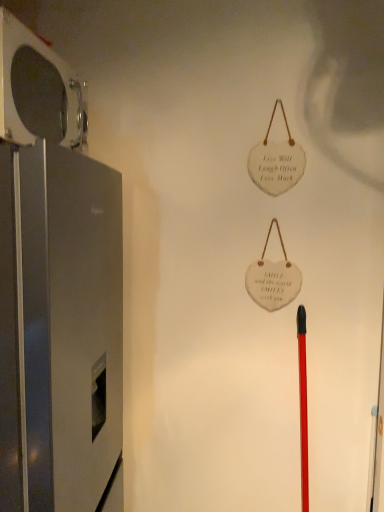
What do you see at coordinates (38, 90) in the screenshot?
I see `metallic gray refrigerator at left, which appears as the 2th appliance when ordered from the bottom` at bounding box center [38, 90].

Identify the location of metallic gray refrigerator at left, which appears as the first appliance when viewed from the top. (38, 90).

What is the approximate width of metallic gray refrigerator at left, which appears as the first appliance when viewed from the top?

11.43 inches.

Measure the distance between metallic gray refrigerator at left, which appears as the first appliance when viewed from the top, and camera.

metallic gray refrigerator at left, which appears as the first appliance when viewed from the top, is 30.98 inches from camera.

I want to click on satin silver refrigerator at left, the 1th appliance when ordered from bottom to top, so click(x=61, y=327).

The width and height of the screenshot is (384, 512). Describe the element at coordinates (61, 327) in the screenshot. I see `satin silver refrigerator at left, the 1th appliance when ordered from bottom to top` at that location.

In order to face satin silver refrigerator at left, the second appliance positioned from the top, should I rotate leftwards or rightwards?

Rotate left and turn 21.458 degrees.

At what (x,y) coordinates should I click in order to perform the action: click on metallic gray refrigerator at left, which appears as the 2th appliance when ordered from the bottom. Please return your answer as a coordinate pair (x, y). Looking at the image, I should click on (38, 90).

Considering the positions of objects metallic gray refrigerator at left, which appears as the 2th appliance when ordered from the bottom, and satin silver refrigerator at left, the 1th appliance when ordered from bottom to top, in the image provided, who is more to the right, metallic gray refrigerator at left, which appears as the 2th appliance when ordered from the bottom, or satin silver refrigerator at left, the 1th appliance when ordered from bottom to top,?

Positioned to the right is satin silver refrigerator at left, the 1th appliance when ordered from bottom to top.

Is metallic gray refrigerator at left, which appears as the first appliance when viewed from the top, further to camera compared to satin silver refrigerator at left, the 1th appliance when ordered from bottom to top?

Yes, the depth of metallic gray refrigerator at left, which appears as the first appliance when viewed from the top, is greater than that of satin silver refrigerator at left, the 1th appliance when ordered from bottom to top.

Which point is more forward, (61, 141) or (115, 444)?

Point (61, 141)

From the image's perspective, relative to satin silver refrigerator at left, the 1th appliance when ordered from bottom to top, is metallic gray refrigerator at left, which appears as the 2th appliance when ordered from the bottom, above or below?

A: metallic gray refrigerator at left, which appears as the 2th appliance when ordered from the bottom, is situated higher than satin silver refrigerator at left, the 1th appliance when ordered from bottom to top, in the image.

From a real-world perspective, relative to satin silver refrigerator at left, the second appliance positioned from the top, is metallic gray refrigerator at left, which appears as the 2th appliance when ordered from the bottom, vertically above or below?

In terms of real-world spatial position, metallic gray refrigerator at left, which appears as the 2th appliance when ordered from the bottom, is above satin silver refrigerator at left, the second appliance positioned from the top.

Between metallic gray refrigerator at left, which appears as the 2th appliance when ordered from the bottom, and satin silver refrigerator at left, the 1th appliance when ordered from bottom to top, which one has larger width?

Wider between the two is satin silver refrigerator at left, the 1th appliance when ordered from bottom to top.

From their relative heights in the image, would you say metallic gray refrigerator at left, which appears as the 2th appliance when ordered from the bottom, is taller or shorter than satin silver refrigerator at left, the second appliance positioned from the top?

Clearly, metallic gray refrigerator at left, which appears as the 2th appliance when ordered from the bottom, is shorter compared to satin silver refrigerator at left, the second appliance positioned from the top.

Can you confirm if metallic gray refrigerator at left, which appears as the 2th appliance when ordered from the bottom, is bigger than satin silver refrigerator at left, the 1th appliance when ordered from bottom to top?

No.

Consider the image. Is satin silver refrigerator at left, the second appliance positioned from the top, a part of metallic gray refrigerator at left, which appears as the 2th appliance when ordered from the bottom?

Definitely not — satin silver refrigerator at left, the second appliance positioned from the top, is not inside metallic gray refrigerator at left, which appears as the 2th appliance when ordered from the bottom.

Is metallic gray refrigerator at left, which appears as the 2th appliance when ordered from the bottom, positioned with its back to satin silver refrigerator at left, the second appliance positioned from the top?

No, metallic gray refrigerator at left, which appears as the 2th appliance when ordered from the bottom, is not facing away from satin silver refrigerator at left, the second appliance positioned from the top.

Can you tell me how much metallic gray refrigerator at left, which appears as the first appliance when viewed from the top, and satin silver refrigerator at left, the second appliance positioned from the top, differ in facing direction?

The facing directions of metallic gray refrigerator at left, which appears as the first appliance when viewed from the top, and satin silver refrigerator at left, the second appliance positioned from the top, are 2.64 degrees apart.

Identify the location of appliance on the left of satin silver refrigerator at left, the 1th appliance when ordered from bottom to top. The width and height of the screenshot is (384, 512). (38, 90).

Considering the positions of objects satin silver refrigerator at left, the 1th appliance when ordered from bottom to top, and metallic gray refrigerator at left, which appears as the 2th appliance when ordered from the bottom, in the image provided, who is more to the right, satin silver refrigerator at left, the 1th appliance when ordered from bottom to top, or metallic gray refrigerator at left, which appears as the 2th appliance when ordered from the bottom,?

satin silver refrigerator at left, the 1th appliance when ordered from bottom to top.

In the scene shown: Considering their positions, is satin silver refrigerator at left, the 1th appliance when ordered from bottom to top, located in front of or behind metallic gray refrigerator at left, which appears as the 2th appliance when ordered from the bottom?

Clearly, satin silver refrigerator at left, the 1th appliance when ordered from bottom to top, is in front of metallic gray refrigerator at left, which appears as the 2th appliance when ordered from the bottom.

Considering the points (44, 437) and (68, 135), which point is in front, point (44, 437) or point (68, 135)?

Positioned in front is point (44, 437).

From the image's perspective, which is below, satin silver refrigerator at left, the second appliance positioned from the top, or metallic gray refrigerator at left, which appears as the 2th appliance when ordered from the bottom?

satin silver refrigerator at left, the second appliance positioned from the top, from the image's perspective.

From a real-world perspective, who is located higher, satin silver refrigerator at left, the second appliance positioned from the top, or metallic gray refrigerator at left, which appears as the first appliance when viewed from the top?

metallic gray refrigerator at left, which appears as the first appliance when viewed from the top, is physically above.

Can you confirm if satin silver refrigerator at left, the second appliance positioned from the top, is wider than metallic gray refrigerator at left, which appears as the first appliance when viewed from the top?

Yes, satin silver refrigerator at left, the second appliance positioned from the top, is wider than metallic gray refrigerator at left, which appears as the first appliance when viewed from the top.

Does satin silver refrigerator at left, the 1th appliance when ordered from bottom to top, have a lesser height compared to metallic gray refrigerator at left, which appears as the first appliance when viewed from the top?

No.

Is satin silver refrigerator at left, the 1th appliance when ordered from bottom to top, smaller than metallic gray refrigerator at left, which appears as the first appliance when viewed from the top?

No, satin silver refrigerator at left, the 1th appliance when ordered from bottom to top, is not smaller than metallic gray refrigerator at left, which appears as the first appliance when viewed from the top.

In the scene shown: Is metallic gray refrigerator at left, which appears as the first appliance when viewed from the top, a part of satin silver refrigerator at left, the second appliance positioned from the top?

Actually, metallic gray refrigerator at left, which appears as the first appliance when viewed from the top, is outside satin silver refrigerator at left, the second appliance positioned from the top.

Are satin silver refrigerator at left, the second appliance positioned from the top, and metallic gray refrigerator at left, which appears as the 2th appliance when ordered from the bottom, located far from each other?

satin silver refrigerator at left, the second appliance positioned from the top, is actually quite close to metallic gray refrigerator at left, which appears as the 2th appliance when ordered from the bottom.

Is satin silver refrigerator at left, the second appliance positioned from the top, facing away from metallic gray refrigerator at left, which appears as the 2th appliance when ordered from the bottom?

satin silver refrigerator at left, the second appliance positioned from the top, does not have its back to metallic gray refrigerator at left, which appears as the 2th appliance when ordered from the bottom.

In the scene shown: Can you tell me how much satin silver refrigerator at left, the second appliance positioned from the top, and metallic gray refrigerator at left, which appears as the first appliance when viewed from the top, differ in facing direction?

There is a 2.64-degree angle between the facing directions of satin silver refrigerator at left, the second appliance positioned from the top, and metallic gray refrigerator at left, which appears as the first appliance when viewed from the top.

Measure the distance from satin silver refrigerator at left, the 1th appliance when ordered from bottom to top, to metallic gray refrigerator at left, which appears as the 2th appliance when ordered from the bottom.

They are 12.66 inches apart.

What are the coordinates of `appliance located on the right of metallic gray refrigerator at left, which appears as the 2th appliance when ordered from the bottom` in the screenshot? It's located at (61, 327).

Identify the location of appliance lying behind the satin silver refrigerator at left, the second appliance positioned from the top. The image size is (384, 512). [38, 90].

Where is `appliance on the left side of satin silver refrigerator at left, the 1th appliance when ordered from bottom to top`? The image size is (384, 512). appliance on the left side of satin silver refrigerator at left, the 1th appliance when ordered from bottom to top is located at coordinates (38, 90).